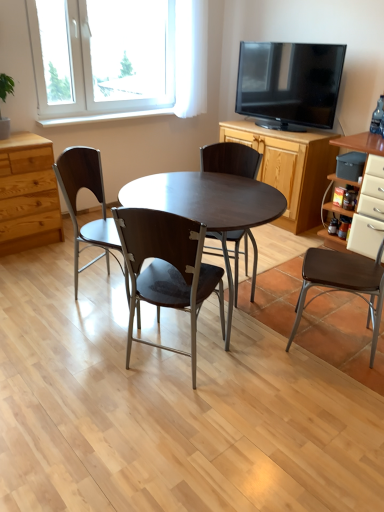
Where is `blank area beneath transparent glass window at upper left (from a real-world perspective)`? blank area beneath transparent glass window at upper left (from a real-world perspective) is located at coordinates (117, 112).